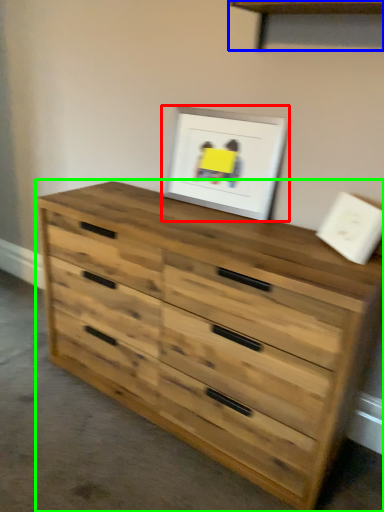
Question: Based on their relative distances, which object is nearer to picture frame (highlighted by a red box)? Choose from shelf (highlighted by a blue box) and chest of drawers (highlighted by a green box).

Choices:
 (A) shelf
 (B) chest of drawers

Answer: (A)